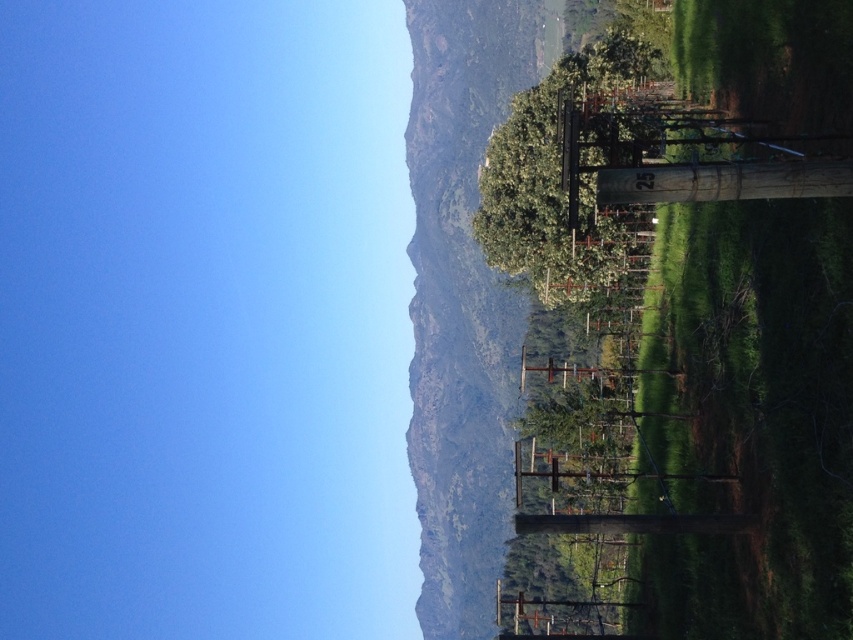
Consider the image. You are standing in the vineyard and want to walk towards the green leafy tree at center. Which direction should you head to avoid the green grassy hillside at right?

To avoid the green grassy hillside at right, you should head towards the green leafy tree at center by moving to the left, as the hillside is positioned below the tree.

You are standing in the vineyard and want to determine which object in the scene is taller. You see the green leafy hillside at upper center and the green leafy tree at center. Which one is taller?

The green leafy hillside at upper center is taller than the green leafy tree at center according to the description.